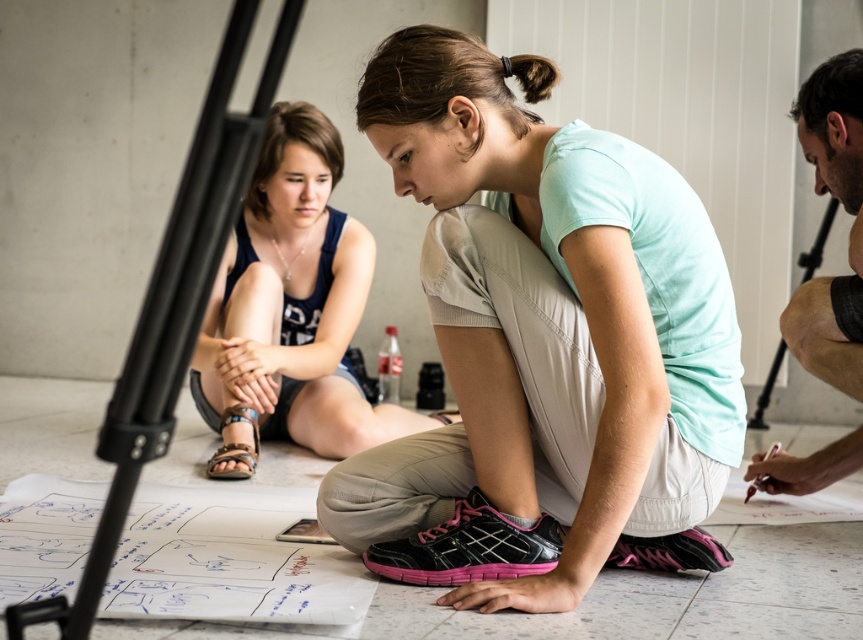
Question: Considering the real-world distances, which object is farthest from the matte white shorts at center?

Choices:
 (A) smooth skin man at right
 (B) matte light blue shirt at center

Answer: (A)

Question: Which point is closer to the camera?

Choices:
 (A) matte light blue shirt at center
 (B) matte white shorts at center

Answer: (A)

Question: From the image, what is the correct spatial relationship of matte light blue shirt at center in relation to smooth skin man at right?

Choices:
 (A) left
 (B) right

Answer: (A)

Question: Does matte light blue shirt at center appear on the right side of smooth skin man at right?

Choices:
 (A) no
 (B) yes

Answer: (A)

Question: Based on their relative distances, which object is farther from the smooth skin man at right?

Choices:
 (A) matte light blue shirt at center
 (B) matte white shorts at center

Answer: (B)

Question: Does matte white shorts at center appear over smooth skin man at right?

Choices:
 (A) no
 (B) yes

Answer: (B)